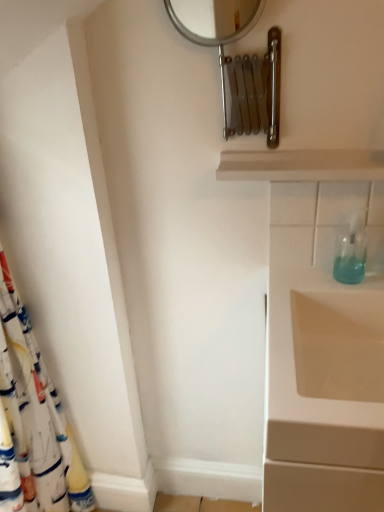
You are a GUI agent. You are given a task and a screenshot of the screen. Output one action in this format:
    pyautogui.click(x=<x>, y=<y>)
    Task: Click on the free space above white wood shelf at upper center (from a real-world perspective)
    The height and width of the screenshot is (512, 384).
    Given the screenshot: What is the action you would take?
    tap(292, 154)